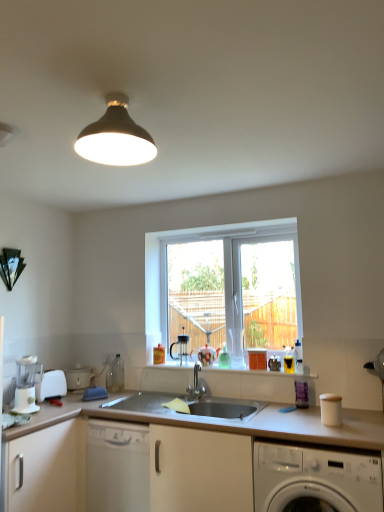
Question: Does white plastic food processor at lower left, which is the second appliance in back-to-front order, touch white matte countertop at center?

Choices:
 (A) no
 (B) yes

Answer: (A)

Question: Is white plastic food processor at lower left, acting as the 1th appliance starting from the front, in front of white matte countertop at center?

Choices:
 (A) no
 (B) yes

Answer: (A)

Question: Is white plastic food processor at lower left, acting as the 1th appliance starting from the front, surrounding white matte countertop at center?

Choices:
 (A) yes
 (B) no

Answer: (B)

Question: From the image's perspective, is white plastic food processor at lower left, acting as the 1th appliance starting from the front, above white matte countertop at center?

Choices:
 (A) no
 (B) yes

Answer: (B)

Question: From the image's perspective, does white plastic food processor at lower left, acting as the 1th appliance starting from the front, appear lower than white matte countertop at center?

Choices:
 (A) no
 (B) yes

Answer: (A)

Question: From their relative heights in the image, would you say white plastic toaster at lower left, which appears as the 1th appliance when viewed from the back, is taller or shorter than white matte cabinet at lower left?

Choices:
 (A) short
 (B) tall

Answer: (A)

Question: Looking at the image, does white plastic toaster at lower left, which appears as the 2th appliance when viewed from the front, seem bigger or smaller compared to white matte cabinet at lower left?

Choices:
 (A) big
 (B) small

Answer: (B)

Question: Does point (74, 375) appear closer or farther from the camera than point (49, 507)?

Choices:
 (A) farther
 (B) closer

Answer: (A)

Question: Would you say white plastic toaster at lower left, which appears as the 1th appliance when viewed from the back, is inside or outside white matte cabinet at lower left?

Choices:
 (A) inside
 (B) outside

Answer: (B)

Question: Considering the relative positions of white plastic blender at lower left, the 2th coffee machine positioned from the back, and white matte cabinet at lower left in the image provided, is white plastic blender at lower left, the 2th coffee machine positioned from the back, to the left or to the right of white matte cabinet at lower left?

Choices:
 (A) left
 (B) right

Answer: (B)

Question: Is white plastic blender at lower left, arranged as the first coffee machine when viewed from the left, bigger or smaller than white matte cabinet at lower left?

Choices:
 (A) big
 (B) small

Answer: (B)

Question: Is white plastic blender at lower left, arranged as the first coffee machine when viewed from the left, in front of or behind white matte cabinet at lower left in the image?

Choices:
 (A) front
 (B) behind

Answer: (B)

Question: From the image's perspective, is white plastic blender at lower left, acting as the 1th coffee machine starting from the front, above or below white matte cabinet at lower left?

Choices:
 (A) below
 (B) above

Answer: (B)

Question: From the image's perspective, is white plastic toaster at lower left, which appears as the 2th appliance when viewed from the front, positioned above or below white matte countertop at center?

Choices:
 (A) above
 (B) below

Answer: (A)

Question: Is white plastic toaster at lower left, which appears as the 1th appliance when viewed from the back, taller or shorter than white matte countertop at center?

Choices:
 (A) tall
 (B) short

Answer: (B)